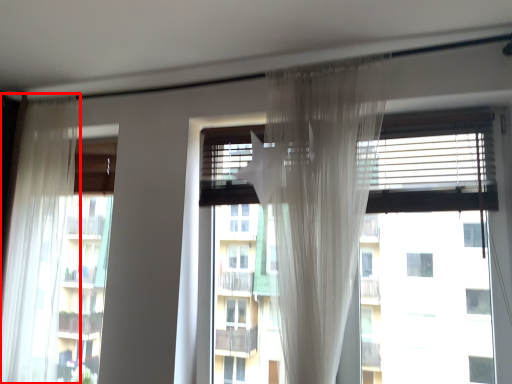
Question: From the image's perspective, where is curtain (annotated by the red box) located relative to window?

Choices:
 (A) above
 (B) below

Answer: (B)